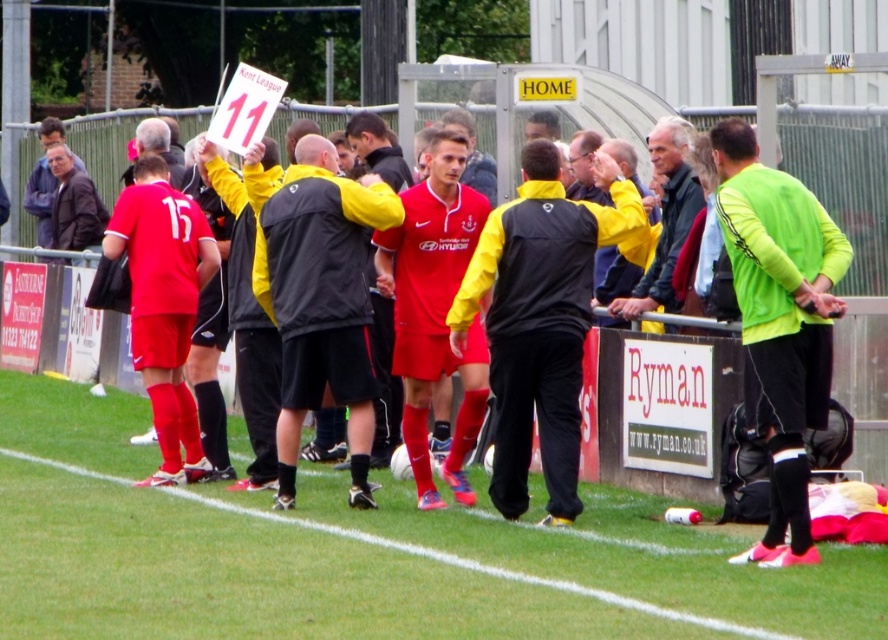
Measure the distance from black matte jacket at center to matte black jacket at center.

black matte jacket at center and matte black jacket at center are 3.85 feet apart.

Which is in front, point (482, 250) or point (308, 307)?

Point (482, 250) is in front.

At what (x,y) coordinates should I click in order to perform the action: click on black matte jacket at center. Please return your answer as a coordinate pair (x, y). Looking at the image, I should click on (538, 321).

Can you confirm if green grass at center is positioned to the left of dark gray jacket at center?

Correct, you'll find green grass at center to the left of dark gray jacket at center.

At what (x,y) coordinates should I click in order to perform the action: click on green grass at center. Please return your answer as a coordinate pair (x, y). Looking at the image, I should click on point(361,554).

Is green grass at center thinner than matte red jersey at center?

Incorrect, green grass at center's width is not less than matte red jersey at center's.

Can you confirm if green grass at center is positioned to the right of matte red jersey at center?

In fact, green grass at center is to the left of matte red jersey at center.

Is point (363, 634) behind point (801, 461)?

That is False.

Where is `green grass at center`? green grass at center is located at coordinates [361, 554].